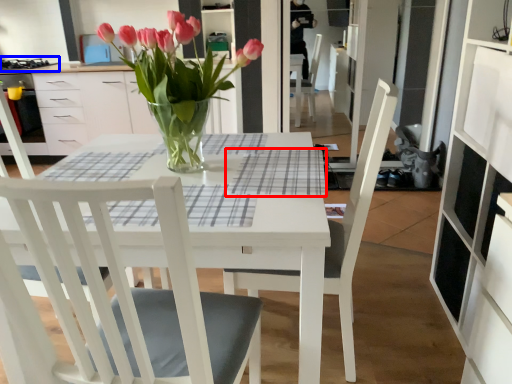
Question: Which of the following is the farthest to the observer, plaid (highlighted by a red box) or gas stove (highlighted by a blue box)?

Choices:
 (A) plaid
 (B) gas stove

Answer: (B)